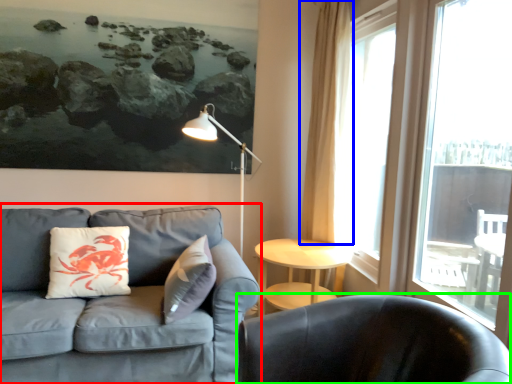
Question: Which object is the farthest from studio couch (highlighted by a red box)? Choose among these: curtain (highlighted by a blue box) or chair (highlighted by a green box).

Choices:
 (A) curtain
 (B) chair

Answer: (A)